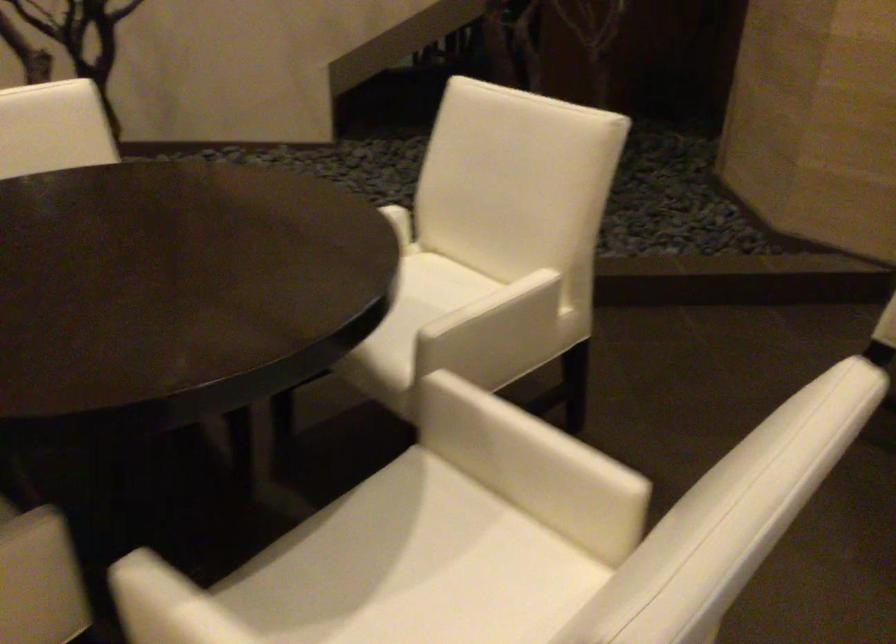
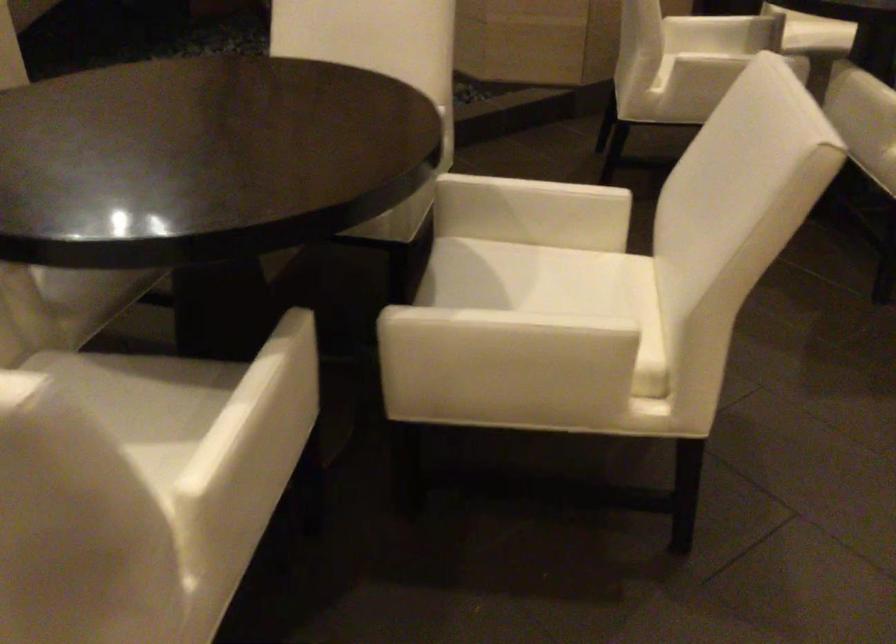
Find the pixel in the second image that matches [533,431] in the first image.

(538, 185)